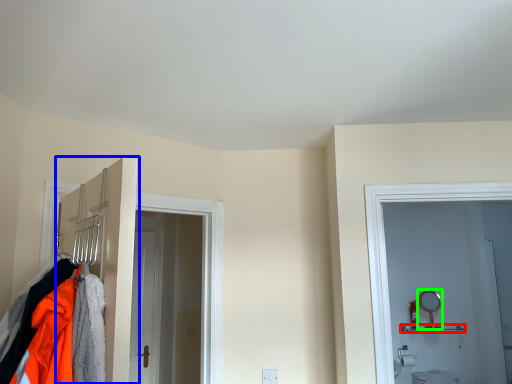
Question: Based on their relative distances, which object is farther from shelf (highlighted by a red box)? Choose from door (highlighted by a blue box) and mirror (highlighted by a green box).

Choices:
 (A) door
 (B) mirror

Answer: (A)